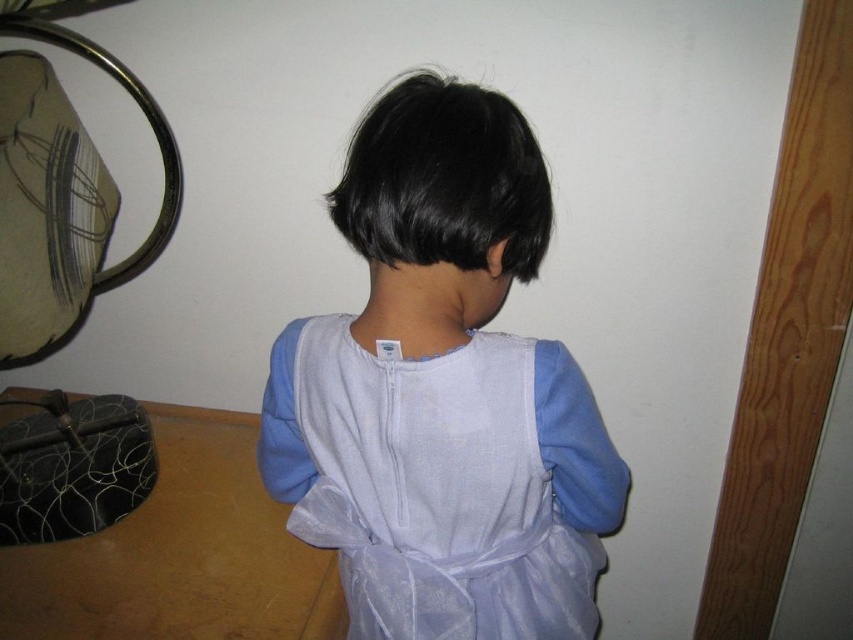
Is point (546, 467) positioned before point (502, 552)?

Yes, it is in front of point (502, 552).

Can you confirm if light blue fabric dress at center is positioned to the right of light blue sheer fabric apron at back?

No, light blue fabric dress at center is not to the right of light blue sheer fabric apron at back.

Who is more forward, (312, 518) or (397, 465)?

Point (397, 465)

Locate an element on the screen. light blue fabric dress at center is located at coordinates (444, 392).

Who is lower down, light blue sheer fabric apron at back or black silky hair at center?

light blue sheer fabric apron at back is below.

Between light blue sheer fabric apron at back and black silky hair at center, which one appears on the right side from the viewer's perspective?

light blue sheer fabric apron at back is more to the right.

Does point (415, 564) come behind point (346, 221)?

Yes, it is behind point (346, 221).

Find the location of `light blue sheer fabric apron at back`. light blue sheer fabric apron at back is located at coordinates (448, 484).

I want to click on light blue fabric dress at center, so click(444, 392).

Can you confirm if light blue fabric dress at center is positioned above black silky hair at center?

Actually, light blue fabric dress at center is below black silky hair at center.

Identify the location of light blue fabric dress at center. (444, 392).